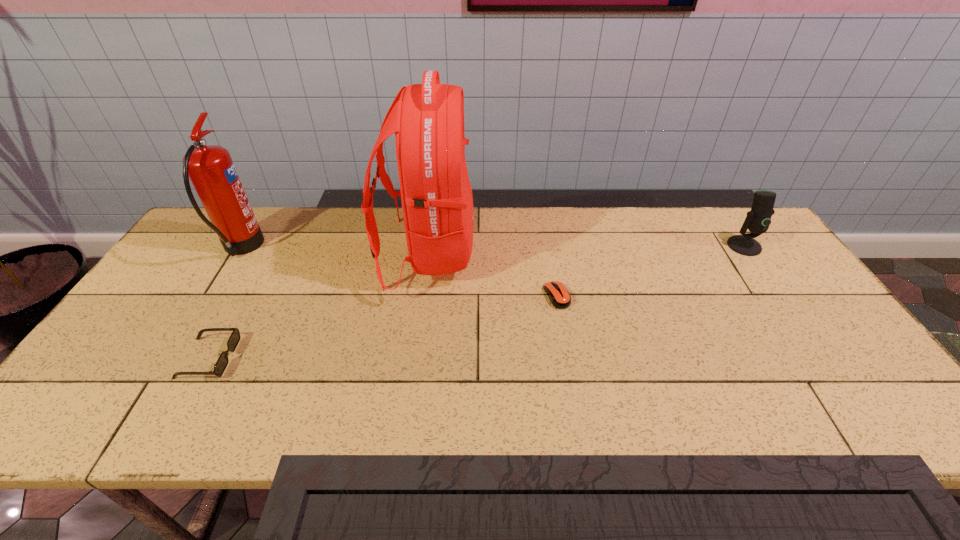
You are a GUI agent. You are given a task and a screenshot of the screen. Output one action in this format:
    pyautogui.click(x=<x>, y=<y>)
    Task: Click on the vacant area in the image that satisfies the following two spatial constraints: 1. on the back side of the computer mouse; 2. on the surface of the fire extinguisher
    
    Given the screenshot: What is the action you would take?
    pyautogui.click(x=548, y=248)

In order to click on blank area in the image that satisfies the following two spatial constraints: 1. on the surface of the second tallest object; 2. on the back side of the computer mouse in this screenshot , I will do `click(211, 296)`.